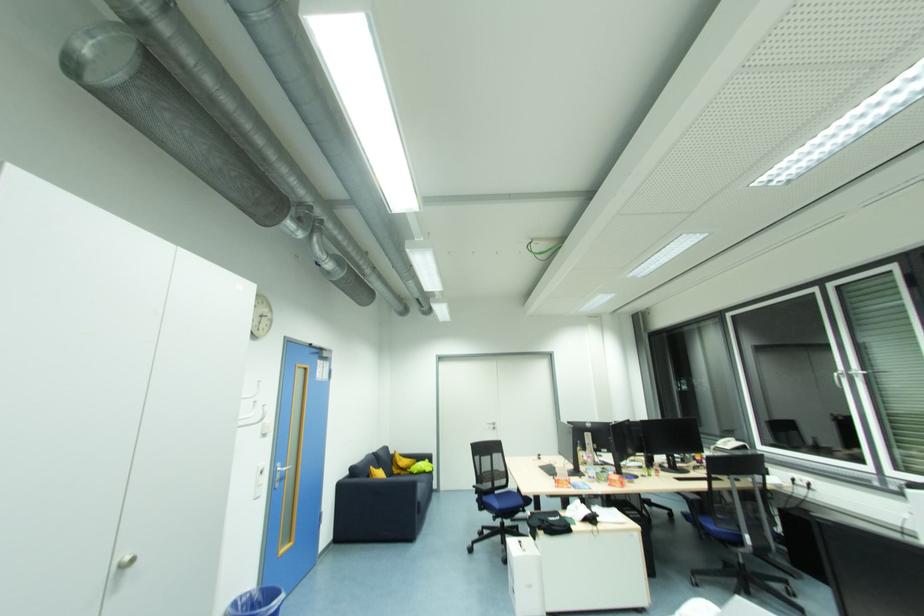
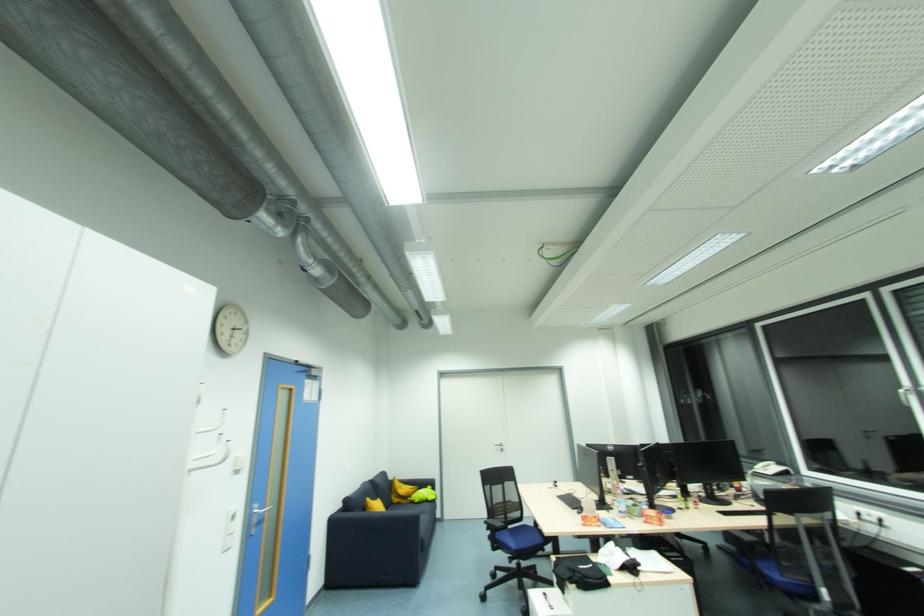
In the second image, find the point that corresponds to point (743, 528) in the first image.

(813, 578)